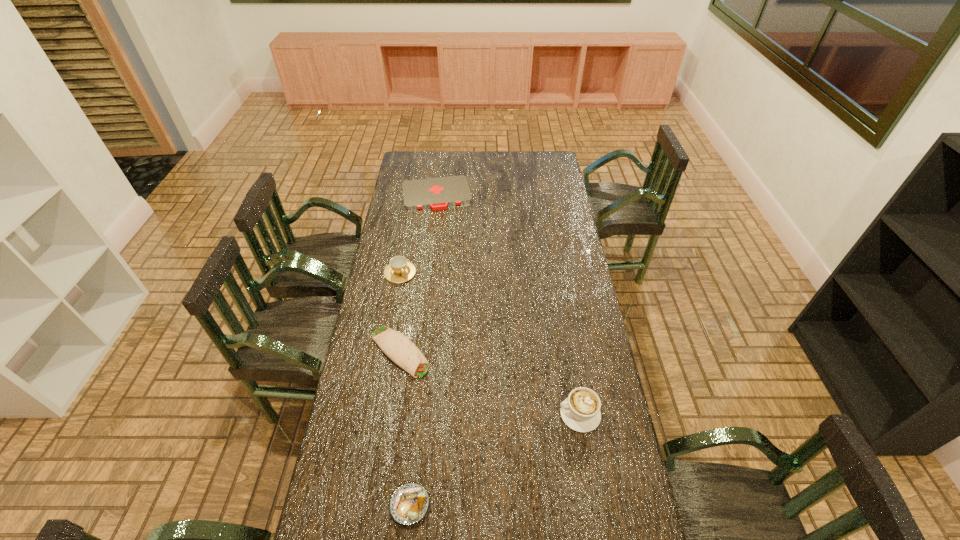
This screenshot has width=960, height=540. Find the location of `free spot between the third farthest object and the nearest object`. free spot between the third farthest object and the nearest object is located at coordinates (405, 428).

Identify the location of free spot between the nearest object and the first-aid kit. (423, 349).

The height and width of the screenshot is (540, 960). I want to click on free space between the farthest object and the fourth shortest object, so click(419, 233).

The height and width of the screenshot is (540, 960). I want to click on free area in between the shortest object and the third nearest object, so click(x=419, y=273).

At what (x,y) coordinates should I click in order to perform the action: click on empty space that is in between the third farthest object and the pastry. Please return your answer as a coordinate pair (x, y). Image resolution: width=960 pixels, height=540 pixels. Looking at the image, I should click on (405, 428).

Find the location of `free spot between the second nearest object and the pastry`. free spot between the second nearest object and the pastry is located at coordinates (494, 460).

Where is `empty space that is in between the cappuccino and the third farthest object`? empty space that is in between the cappuccino and the third farthest object is located at coordinates (490, 383).

Identify the location of vacant point located between the shortest object and the second farthest object. Image resolution: width=960 pixels, height=540 pixels. (419, 233).

Find the location of a particular element. This screenshot has width=960, height=540. vacant space that's between the nearest object and the first-aid kit is located at coordinates (423, 349).

Identify the location of object that is the third closest to the nearest object. (399, 270).